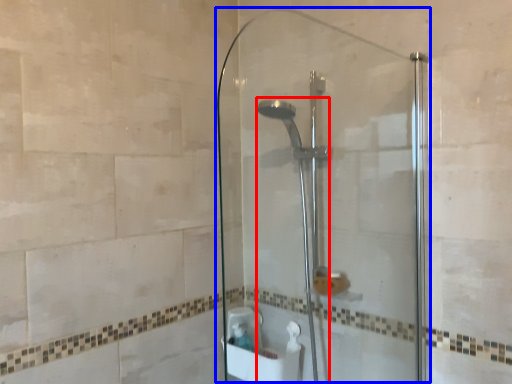
Question: Among these objects, which one is nearest to the camera, shower (highlighted by a red box) or screen door (highlighted by a blue box)?

Choices:
 (A) shower
 (B) screen door

Answer: (B)